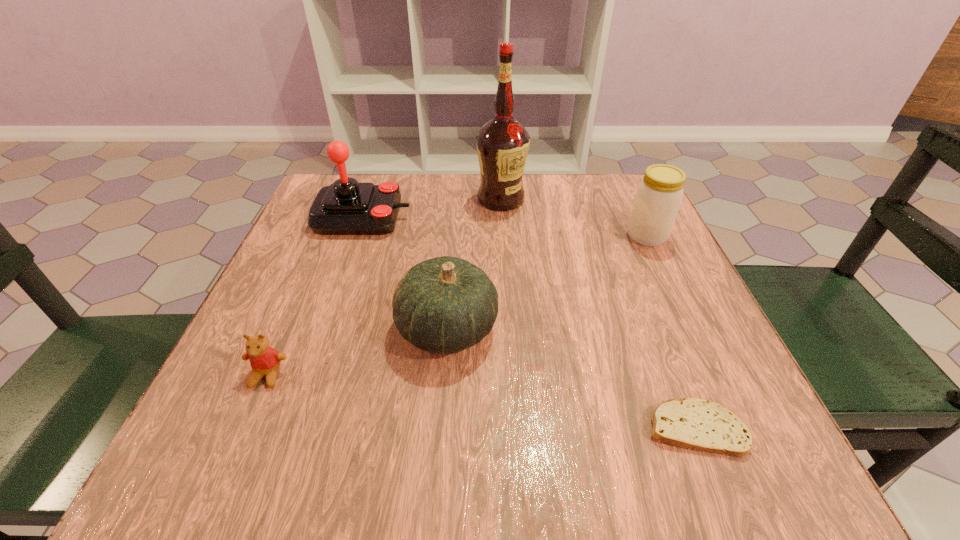
At what (x,y) coordinates should I click in order to perform the action: click on the closest object to the gourd. Please return your answer as a coordinate pair (x, y). The image size is (960, 540). Looking at the image, I should click on (265, 361).

What are the coordinates of `object that is the nearest to the joystick` in the screenshot? It's located at (502, 143).

Where is `free space that satisfies the following two spatial constraints: 1. on the back side of the gourd; 2. on the base of the joystick`? The width and height of the screenshot is (960, 540). free space that satisfies the following two spatial constraints: 1. on the back side of the gourd; 2. on the base of the joystick is located at coordinates (455, 218).

Where is `vacant region that satisfies the following two spatial constraints: 1. on the label of the tallest object; 2. on the right side of the jar`? vacant region that satisfies the following two spatial constraints: 1. on the label of the tallest object; 2. on the right side of the jar is located at coordinates (503, 236).

I want to click on vacant point that satisfies the following two spatial constraints: 1. on the back side of the jar; 2. on the right side of the pita bread, so (619, 236).

Where is `free region that satisfies the following two spatial constraints: 1. on the back side of the gourd; 2. on the base of the joystick`? The width and height of the screenshot is (960, 540). free region that satisfies the following two spatial constraints: 1. on the back side of the gourd; 2. on the base of the joystick is located at coordinates click(x=455, y=218).

Find the location of `free point that satisfies the following two spatial constraints: 1. on the label of the pita bread; 2. on the right side of the alcohol`. free point that satisfies the following two spatial constraints: 1. on the label of the pita bread; 2. on the right side of the alcohol is located at coordinates (516, 428).